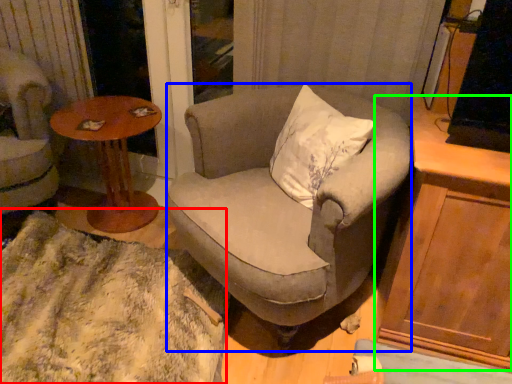
Question: Estimate the real-world distances between objects in this image. Which object is farther from blanket (highlighted by a red box), chair (highlighted by a blue box) or cabinetry (highlighted by a green box)?

Choices:
 (A) chair
 (B) cabinetry

Answer: (B)